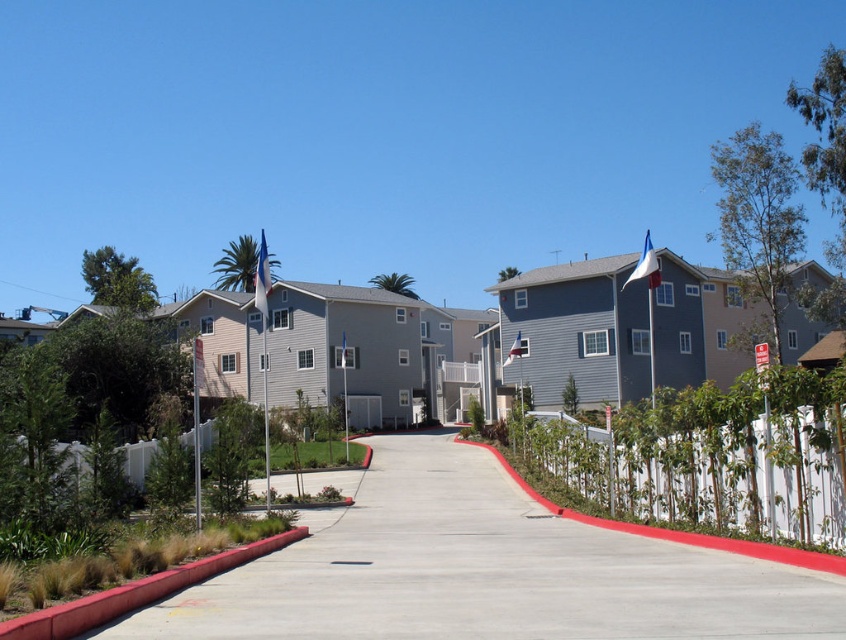
Between concrete at center and white wood fence at center right, which one has less height?

concrete at center

Who is more forward, (638, 630) or (624, 468)?

Point (638, 630) is more forward.

The image size is (846, 640). In order to click on concrete at center in this screenshot , I will do [x=482, y=570].